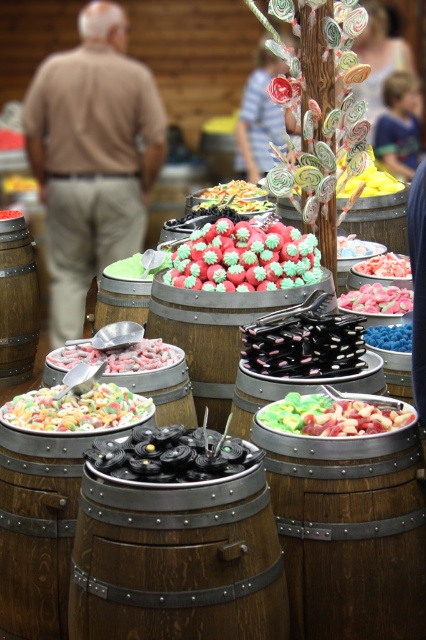
Which is in front, point (48, 93) or point (216, 188)?

Positioned in front is point (216, 188).

Is brown cotton shirt at upper left shorter than shiny metallic lollipops at center?

In fact, brown cotton shirt at upper left may be taller than shiny metallic lollipops at center.

Identify the location of brown cotton shirt at upper left. (92, 157).

Can you confirm if striped shirt at center is shorter than green matte candy at center?

In fact, striped shirt at center may be taller than green matte candy at center.

Is striped shirt at center thinner than green matte candy at center?

In fact, striped shirt at center might be wider than green matte candy at center.

Is point (250, 109) positioned behind point (132, 275)?

Yes, point (250, 109) is behind point (132, 275).

Where is `striped shirt at center`? This screenshot has width=426, height=640. striped shirt at center is located at coordinates (259, 116).

Consider the image. Does blonde hair at upper right have a lesser width compared to white candy at center?

In fact, blonde hair at upper right might be wider than white candy at center.

Between point (379, 122) and point (155, 342), which one is positioned behind?

Point (379, 122)

Is point (382, 145) behind point (144, 340)?

Yes, point (382, 145) is behind point (144, 340).

Where is `blonde hair at upper right`? blonde hair at upper right is located at coordinates (399, 124).